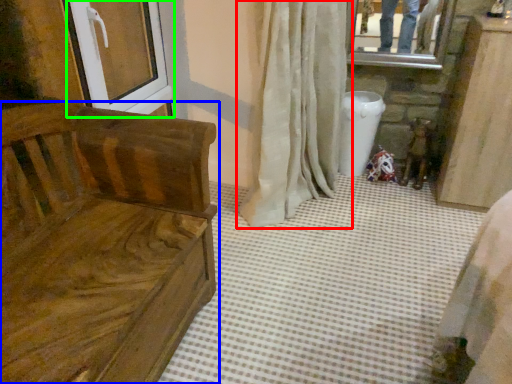
Question: Considering the real-world distances, which object is closest to curtain (highlighted by a red box)? furniture (highlighted by a blue box) or screen door (highlighted by a green box).

Choices:
 (A) furniture
 (B) screen door

Answer: (B)